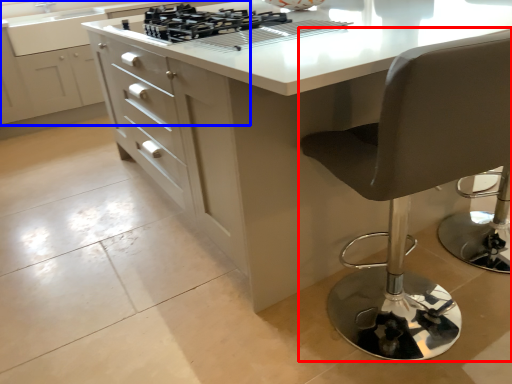
Question: Among these objects, which one is farthest to the camera, chair (highlighted by a red box) or cabinetry (highlighted by a blue box)?

Choices:
 (A) chair
 (B) cabinetry

Answer: (B)